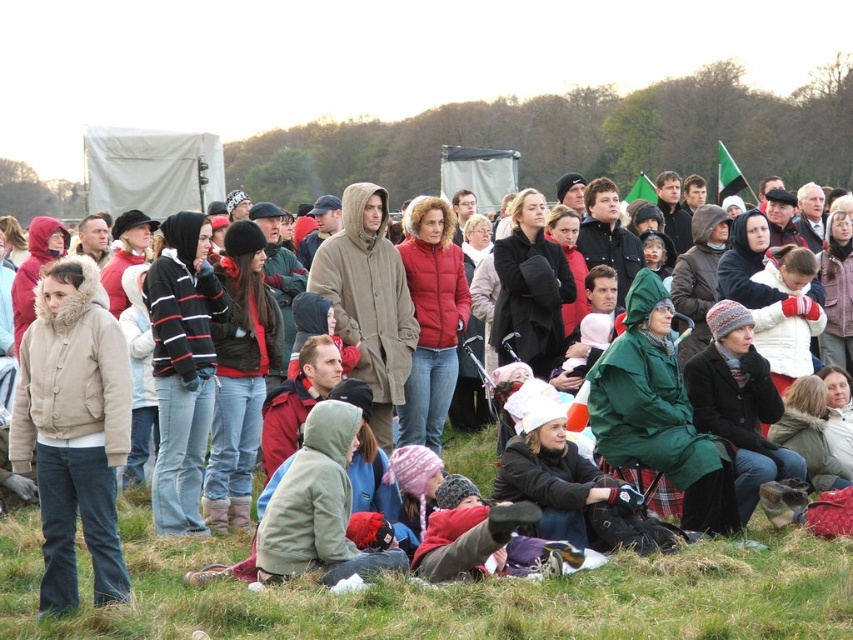
Question: Does matte green coat at center come in front of beige fur-lined jacket at left?

Choices:
 (A) yes
 (B) no

Answer: (A)

Question: Which point is closer to the camera?

Choices:
 (A) (167, 577)
 (B) (769, 582)
 (C) (96, 454)

Answer: (B)

Question: Observing the image, what is the correct spatial positioning of matte green coat at center in reference to beige fur-lined jacket at left?

Choices:
 (A) below
 (B) above

Answer: (A)

Question: Which of the following is the closest to the observer?

Choices:
 (A) (202, 554)
 (B) (693, 593)

Answer: (B)

Question: Which point is farther to the camera?

Choices:
 (A) (187, 547)
 (B) (757, 564)
 (C) (47, 304)

Answer: (A)

Question: Is matte green coat at center wider than beige fur-lined jacket at left?

Choices:
 (A) no
 (B) yes

Answer: (B)